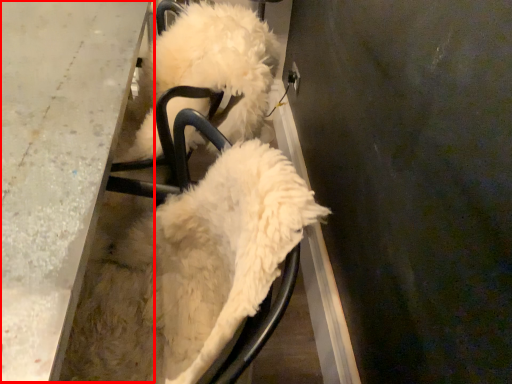
Question: From the image's perspective, considering the relative positions of table (annotated by the red box) and dog in the image provided, where is table (annotated by the red box) located with respect to the staircase?

Choices:
 (A) above
 (B) below

Answer: (A)